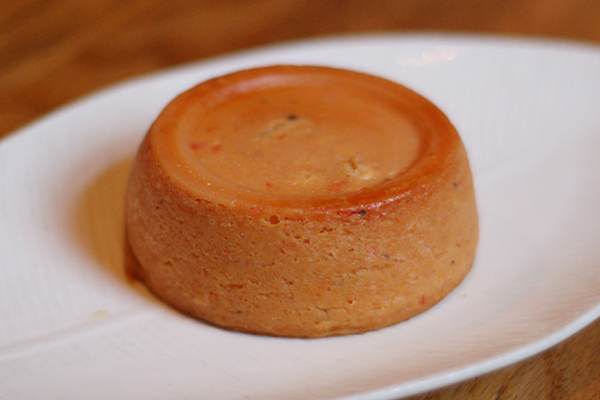
Locate an element on the screen. The image size is (600, 400). table is located at coordinates (569, 389).